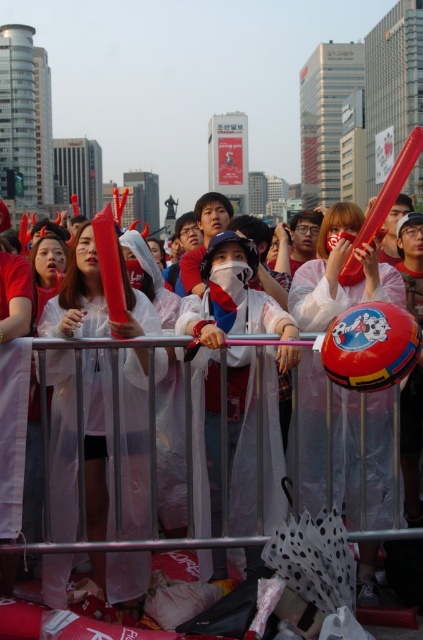
You are standing at the point marked as point (227, 333) in the image. What object are you touching?

Answer: You are touching the white plastic raincoat at center, as the point (227, 333) is located on it.

You are a photographer standing in the city center and see the matte red plastic tube at center and the red glossy helmet at center. Which object is positioned lower in the image?

The matte red plastic tube at center is positioned below the red glossy helmet at center, so it is lower in the image.

You are a delivery drone operator who needs to fly a package from the red glossy helmet at center to the matte red horn at center. The drone has a maximum flight range of 6 meters. Can the drone complete the delivery without needing to recharge?

The distance between the red glossy helmet at center and the matte red horn at center is 6.20 meters. Since the drone can only fly 6 meters before needing to recharge, it cannot complete the delivery without recharging.